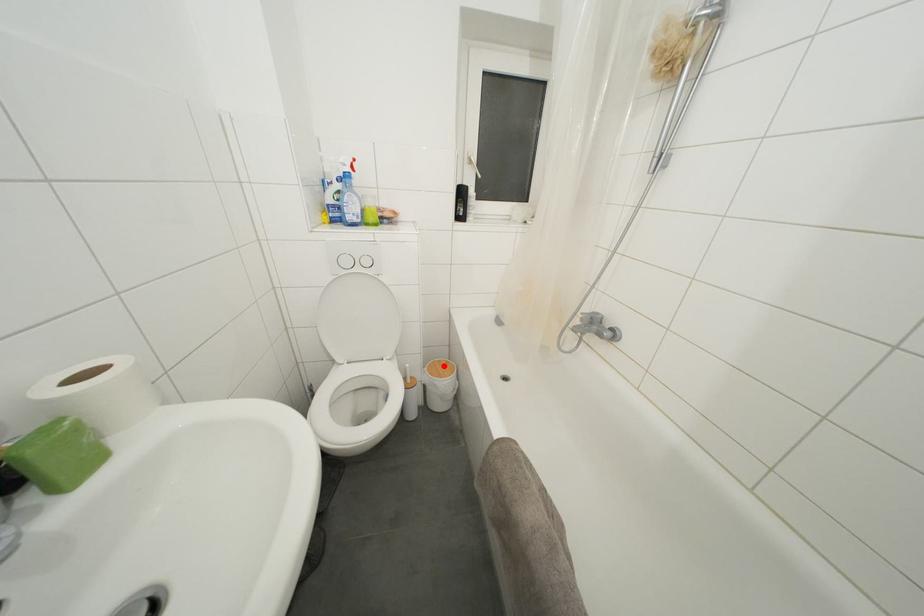
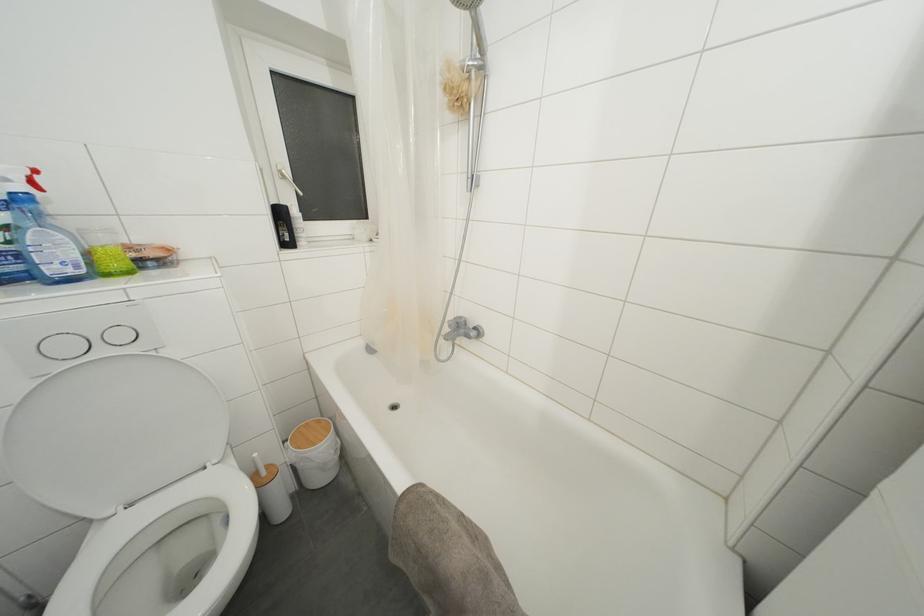
In the second image, find the point that corresponds to the highlighted location in the first image.

(310, 429)